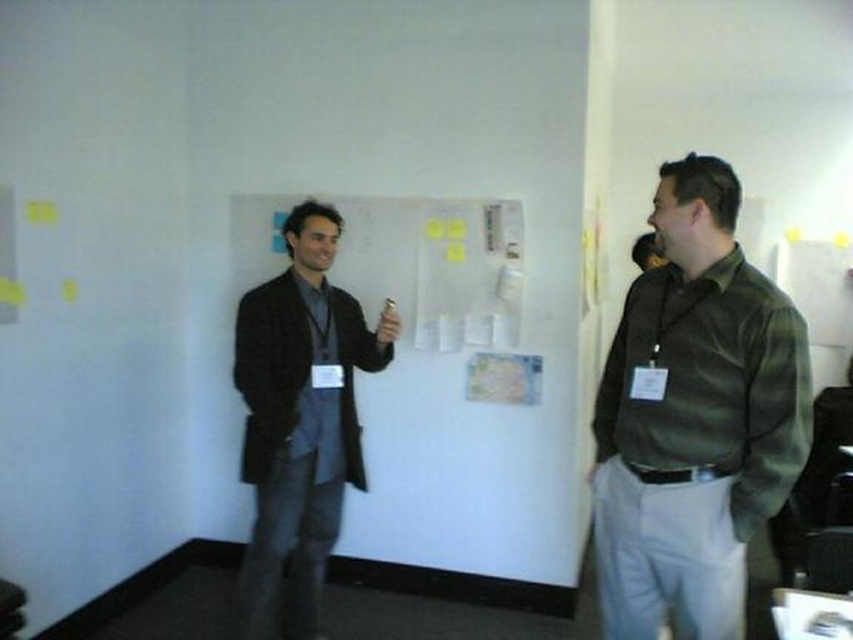
Based on the scene description, where is the white matte board at center located in terms of its 2D coordinates?

The white matte board at center is located at the 2D coordinates of point [467,401].

You are a delivery person who needs to place a package between the white matte board at center and the dark gray wool jacket at left. The package is 24 inches long. Can you fit it in the space between them without moving either object?

The white matte board at center is 23.60 inches away from the dark gray wool jacket at left. Since the package is 24 inches long, it is slightly longer than the available space. Therefore, the package cannot be placed between them without moving either object.